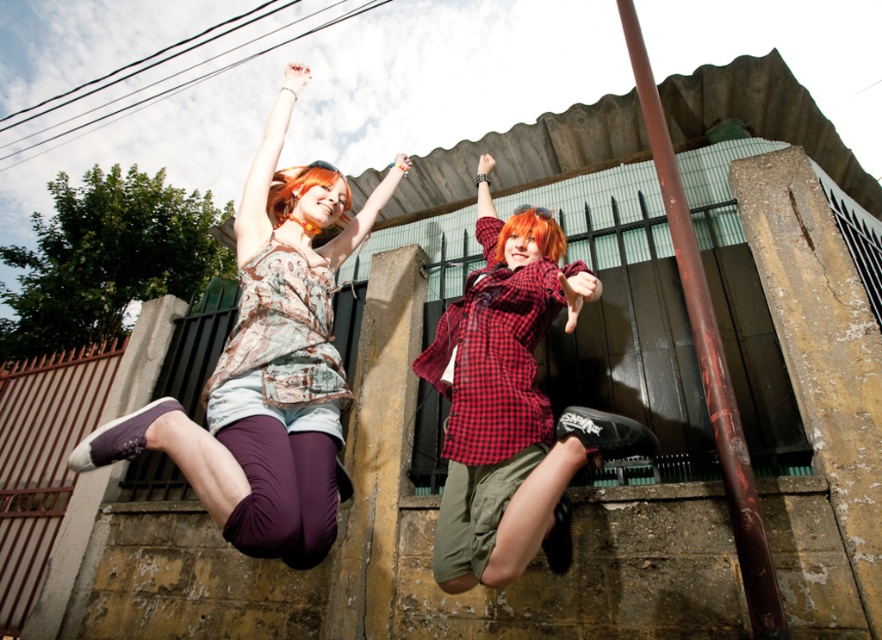
Does point (277, 179) come in front of point (554, 234)?

Yes, point (277, 179) is in front of point (554, 234).

From the picture: Is orange dyed hair at upper center further to the viewer compared to orange matte hair at center?

That is False.

Between point (320, 186) and point (551, 221), which one is positioned behind?

Point (551, 221)

You are a GUI agent. You are given a task and a screenshot of the screen. Output one action in this format:
    pyautogui.click(x=<x>, y=<y>)
    Task: Click on the orange dyed hair at upper center
    
    Given the screenshot: What is the action you would take?
    pyautogui.click(x=296, y=186)

Who is higher up, red checkered shirt at center or smooth brown pole at upper right?

smooth brown pole at upper right is above.

Locate an element on the screen. Image resolution: width=882 pixels, height=640 pixels. red checkered shirt at center is located at coordinates (510, 413).

Is point (608, 440) closer to viewer compared to point (744, 547)?

No, it is behind (744, 547).

I want to click on red checkered shirt at center, so click(x=510, y=413).

Does point (342, 394) come in front of point (703, 333)?

No, it is behind (703, 333).

Which is above, matte brown tank top at upper left or smooth brown pole at upper right?

smooth brown pole at upper right

Between point (370, 212) and point (735, 486), which one is positioned behind?

Positioned behind is point (370, 212).

The width and height of the screenshot is (882, 640). What are the coordinates of `matte brown tank top at upper left` in the screenshot? It's located at (267, 374).